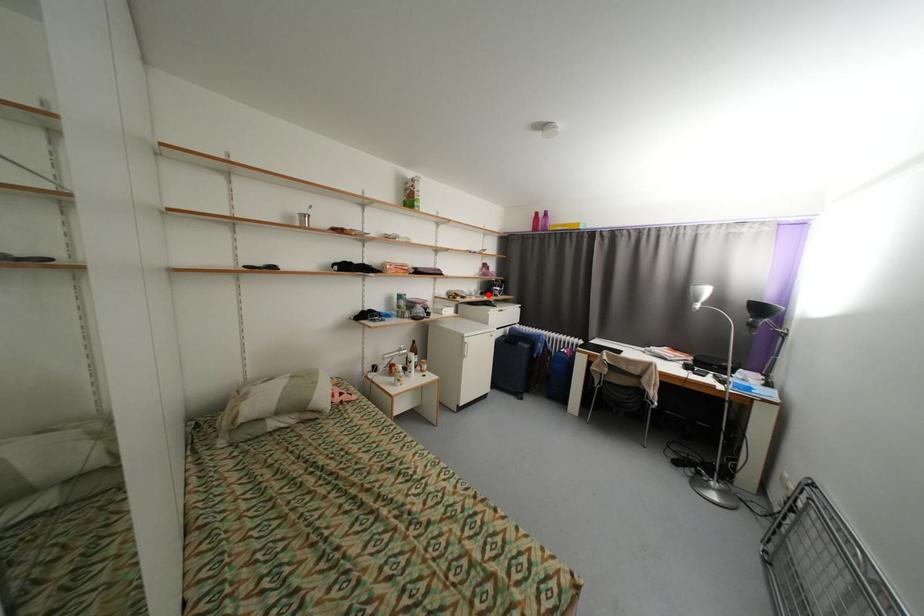
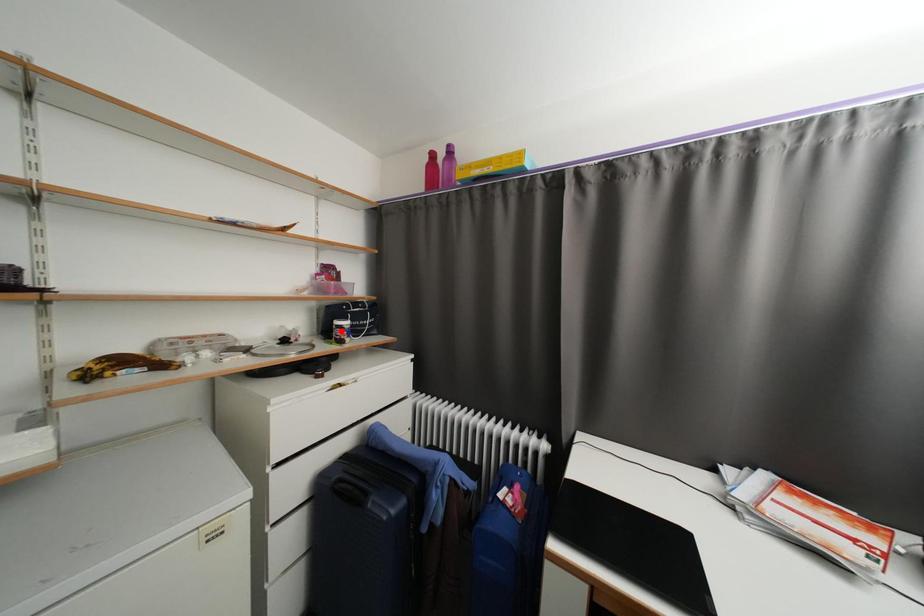
I am providing you with two images of the same scene from different viewpoints. A red point is marked on the first image and another point is marked on the second image. Is the red point in image1 aligned with the point shown in image2?

No